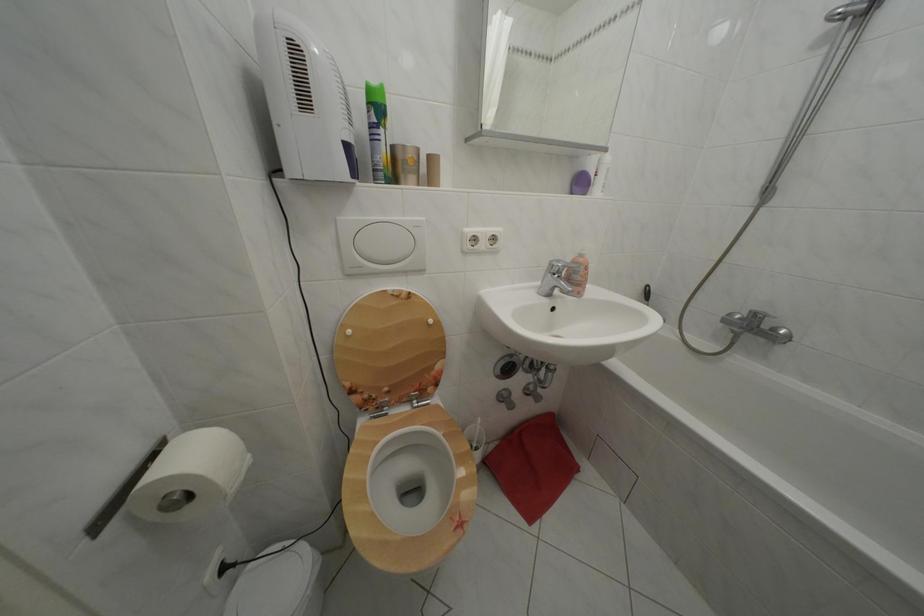
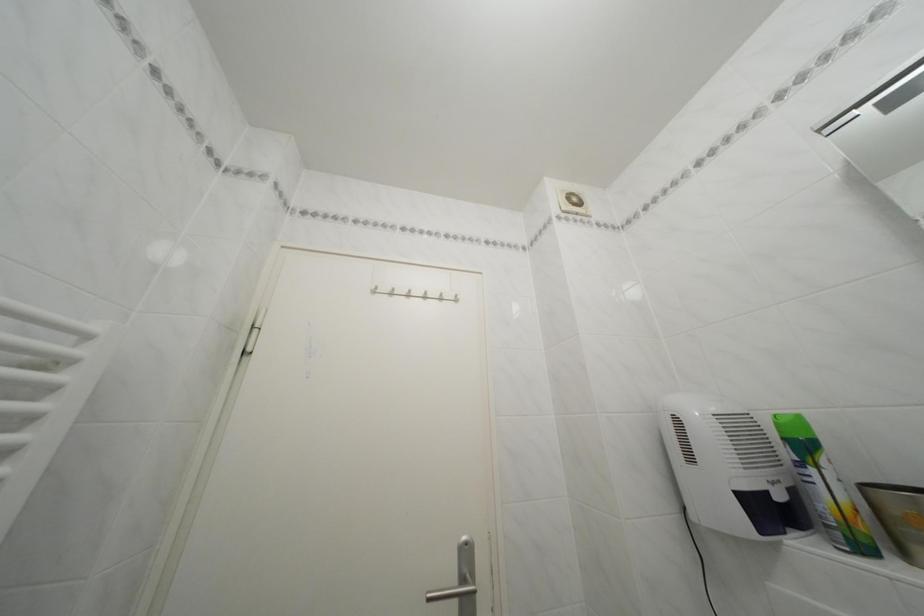
In the second image, find the point that corresponds to pixel 313 108 in the first image.

(699, 464)